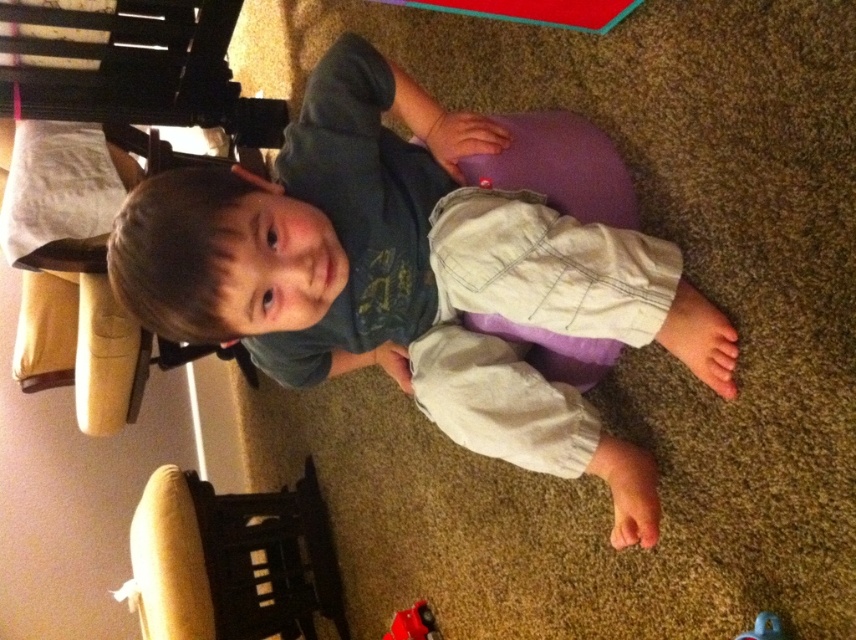
Find the location of a particular element. matte gray shirt at center is located at coordinates (413, 276).

Can you confirm if matte gray shirt at center is positioned below velvet beige bean bag chair at left?

No, matte gray shirt at center is not below velvet beige bean bag chair at left.

What are the coordinates of `matte gray shirt at center` in the screenshot? It's located at (413, 276).

Can you confirm if matte gray shirt at center is thinner than blue rubber duck at lower right?

Incorrect, matte gray shirt at center's width is not less than blue rubber duck at lower right's.

You are a GUI agent. You are given a task and a screenshot of the screen. Output one action in this format:
    pyautogui.click(x=<x>, y=<y>)
    Task: Click on the matte gray shirt at center
    
    Given the screenshot: What is the action you would take?
    pyautogui.click(x=413, y=276)

I want to click on matte gray shirt at center, so click(413, 276).

Is velvet beige bean bag chair at left shorter than blue rubber duck at lower right?

No.

Between velvet beige bean bag chair at left and blue rubber duck at lower right, which one appears on the right side from the viewer's perspective?

blue rubber duck at lower right is more to the right.

Locate an element on the screen. The width and height of the screenshot is (856, 640). velvet beige bean bag chair at left is located at coordinates (232, 561).